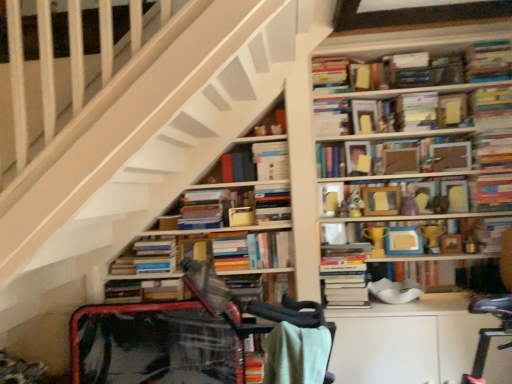
Question: Is matte yellow trophy at center, the eleventh book positioned from the top, taller than matte cardboard frame at upper center, arranged as the 5th paperback book when viewed from the top?

Choices:
 (A) no
 (B) yes

Answer: (B)

Question: Are matte yellow trophy at center, the sixth book ordered from the bottom, and matte cardboard frame at upper center, which is the second paperback book in bottom-to-top order, far apart?

Choices:
 (A) yes
 (B) no

Answer: (B)

Question: From a real-world perspective, does matte yellow trophy at center, the sixth book ordered from the bottom, stand above matte cardboard frame at upper center, arranged as the 5th paperback book when viewed from the top?

Choices:
 (A) no
 (B) yes

Answer: (A)

Question: Is matte yellow trophy at center, the sixth book ordered from the bottom, located outside matte cardboard frame at upper center, arranged as the 5th paperback book when viewed from the top?

Choices:
 (A) no
 (B) yes

Answer: (B)

Question: From the image's perspective, is matte yellow trophy at center, the sixth book ordered from the bottom, on top of matte cardboard frame at upper center, which is the second paperback book in bottom-to-top order?

Choices:
 (A) no
 (B) yes

Answer: (A)

Question: Looking at their shapes, would you say matte cardboard frame at upper center, which is the second paperback book in bottom-to-top order, is wider or thinner than hardcover books at upper center, marked as the 15th book in a bottom-to-top arrangement?

Choices:
 (A) thin
 (B) wide

Answer: (A)

Question: Relative to hardcover books at upper center, marked as the 15th book in a bottom-to-top arrangement, is matte cardboard frame at upper center, arranged as the 5th paperback book when viewed from the top, in front or behind?

Choices:
 (A) behind
 (B) front

Answer: (A)

Question: Is matte cardboard frame at upper center, arranged as the 5th paperback book when viewed from the top, taller or shorter than hardcover books at upper center, marked as the 15th book in a bottom-to-top arrangement?

Choices:
 (A) tall
 (B) short

Answer: (B)

Question: From a real-world perspective, is matte cardboard frame at upper center, which is the second paperback book in bottom-to-top order, positioned above or below hardcover books at upper center, marked as the 15th book in a bottom-to-top arrangement?

Choices:
 (A) below
 (B) above

Answer: (A)

Question: Is point (350, 271) positioned closer to the camera than point (325, 218)?

Choices:
 (A) farther
 (B) closer

Answer: (B)

Question: Which is correct: hardcover books at center, the 3th book in the bottom-to-top sequence, is inside matte yellow trophy at center, the eleventh book positioned from the top, or outside of it?

Choices:
 (A) inside
 (B) outside

Answer: (B)

Question: From a real-world perspective, is hardcover books at center, which appears as the fourteenth book when viewed from the top, positioned above or below matte yellow trophy at center, the eleventh book positioned from the top?

Choices:
 (A) below
 (B) above

Answer: (A)

Question: Looking at their shapes, would you say hardcover books at center, the 3th book in the bottom-to-top sequence, is wider or thinner than matte yellow trophy at center, the eleventh book positioned from the top?

Choices:
 (A) wide
 (B) thin

Answer: (A)

Question: Considering the positions of point (141, 241) and point (393, 182), is point (141, 241) closer or farther from the camera than point (393, 182)?

Choices:
 (A) farther
 (B) closer

Answer: (B)

Question: In terms of height, does hardcover books at lower left, the thirteenth book in the top-to-bottom sequence, look taller or shorter compared to wooden picture frame at upper center, the ninth book ordered from the bottom?

Choices:
 (A) tall
 (B) short

Answer: (B)